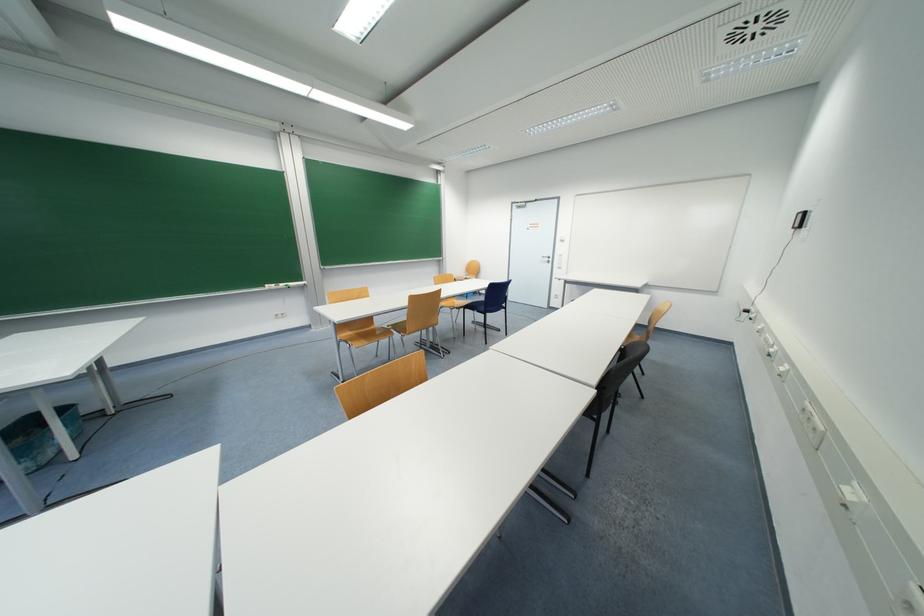
Find the location of a particular element. white wall switch is located at coordinates point(280,315).